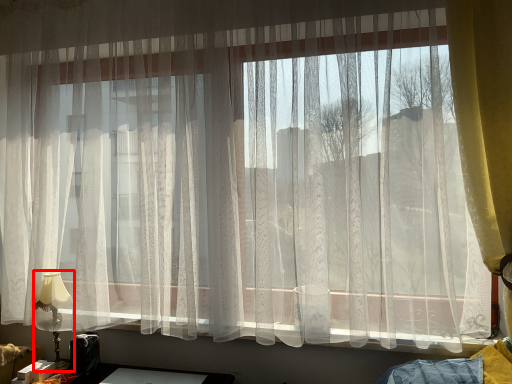
Question: From the image's perspective, what is the correct spatial positioning of table lamp (annotated by the red box) in reference to curtain?

Choices:
 (A) below
 (B) above

Answer: (A)